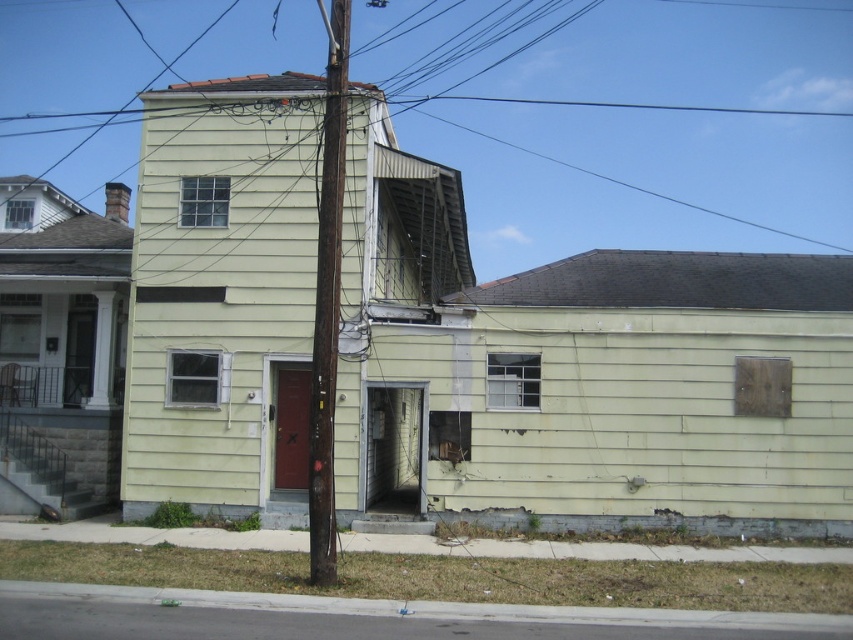
You are standing in front of the residential building and notice two points marked on the wall. The first point is at coordinate point [486,164] and the second is at coordinate point [320,250]. Which point is closer to you?

Point [320,250] is closer to you because it is less further to the camera than point [486,164].

You are a maintenance worker assessing the building. You see the metallic wire at upper center and the front door. Which object is closer to the front door?

The metallic wire at upper center is 60.03 meters away from the front door, so the front door is closer to itself than the metallic wire at upper center. Therefore, the front door is closer.